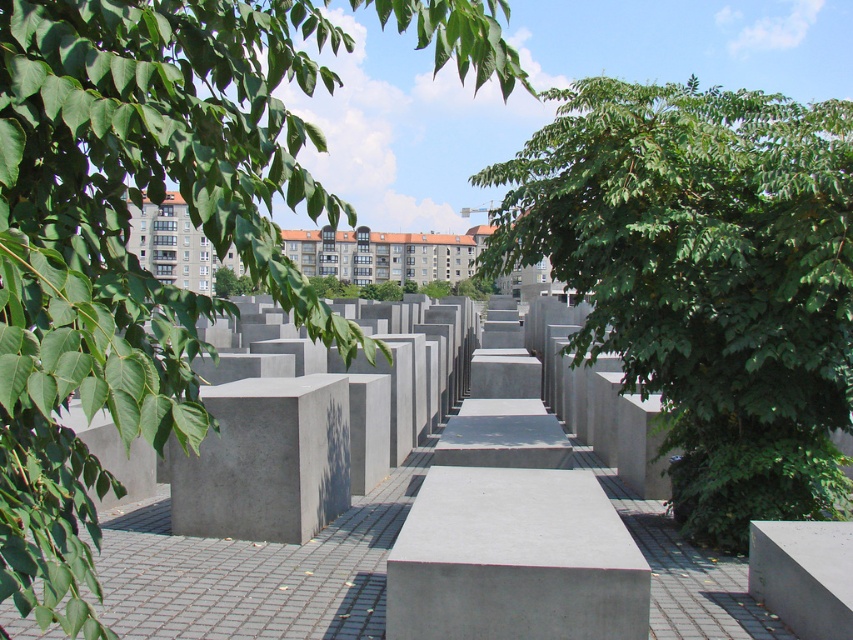
Does green leafy tree at center come behind gray concrete bench at center?

Yes, green leafy tree at center is further from the viewer.

Is the position of green leafy tree at center less distant than that of gray concrete bench at center?

No, it is behind gray concrete bench at center.

Does point (697, 481) lie in front of point (502, 628)?

No, it is not.

Find the location of a particular element. Image resolution: width=853 pixels, height=640 pixels. green leafy tree at center is located at coordinates (704, 280).

Is green leafy tree at upper left to the right of green leafy tree at center from the viewer's perspective?

No, green leafy tree at upper left is not to the right of green leafy tree at center.

Measure the distance between green leafy tree at upper left and green leafy tree at center.

4.24 meters

Is point (51, 340) more distant than point (712, 509)?

No, (51, 340) is in front of (712, 509).

You are a GUI agent. You are given a task and a screenshot of the screen. Output one action in this format:
    pyautogui.click(x=<x>, y=<y>)
    Task: Click on the green leafy tree at upper left
    The width and height of the screenshot is (853, 640).
    Given the screenshot: What is the action you would take?
    pyautogui.click(x=125, y=241)

Is point (126, 428) more distant than point (573, 497)?

No, it is not.

Between green leafy tree at upper left and gray concrete bench at center, which one appears on the left side from the viewer's perspective?

green leafy tree at upper left is more to the left.

At what (x,y) coordinates should I click in order to perform the action: click on green leafy tree at upper left. Please return your answer as a coordinate pair (x, y). The width and height of the screenshot is (853, 640). Looking at the image, I should click on 125,241.

What are the coordinates of `green leafy tree at upper left` in the screenshot? It's located at (125, 241).